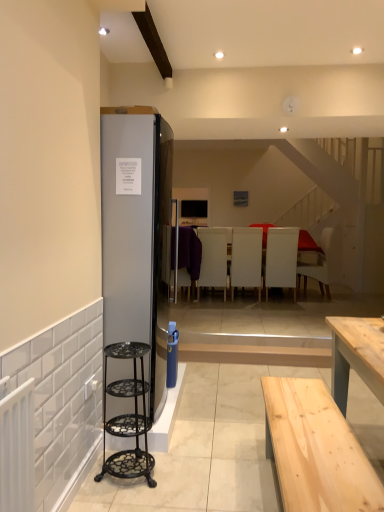
Locate an element on the screen. vacant region to the right of black wrought iron step stool at left is located at coordinates (195, 472).